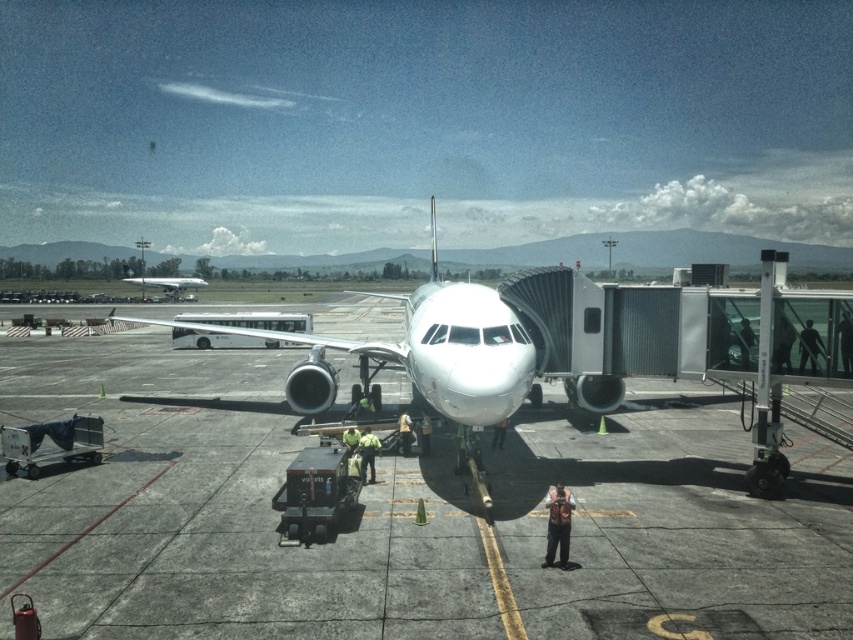
Between gray concrete tarmac at center and metallic silver airplane at center, which one appears on the right side from the viewer's perspective?

From the viewer's perspective, gray concrete tarmac at center appears more on the right side.

Who is shorter, gray concrete tarmac at center or metallic silver airplane at center?

Standing shorter between the two is gray concrete tarmac at center.

Does point (404, 388) come closer to viewer compared to point (469, 355)?

No, (404, 388) is behind (469, 355).

In order to click on gray concrete tarmac at center in this screenshot , I will do `click(404, 515)`.

Which is above, metallic silver airplane at center or silver metallic airplane at center?

silver metallic airplane at center

Measure the distance from metallic silver airplane at center to silver metallic airplane at center.

metallic silver airplane at center is 41.57 meters away from silver metallic airplane at center.

Does point (200, 317) lie in front of point (131, 276)?

Yes.

This screenshot has height=640, width=853. Find the location of `metallic silver airplane at center`. metallic silver airplane at center is located at coordinates (419, 349).

Where is `gray concrete tarmac at center`? The height and width of the screenshot is (640, 853). gray concrete tarmac at center is located at coordinates (404, 515).

Does gray concrete tarmac at center appear under silver metallic airplane at center?

Indeed, gray concrete tarmac at center is positioned under silver metallic airplane at center.

Locate an element on the screen. Image resolution: width=853 pixels, height=640 pixels. gray concrete tarmac at center is located at coordinates (404, 515).